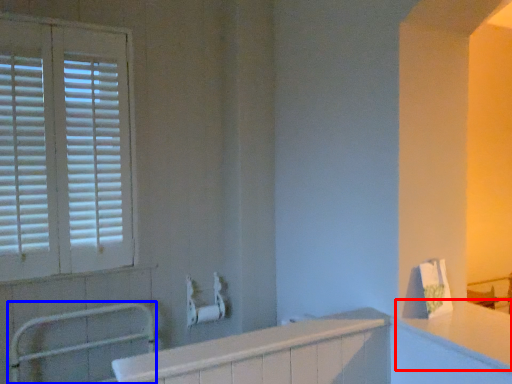
Question: Which object appears closest to the camera in this image, counter top (highlighted by a red box) or balustrade (highlighted by a blue box)?

Choices:
 (A) counter top
 (B) balustrade

Answer: (A)